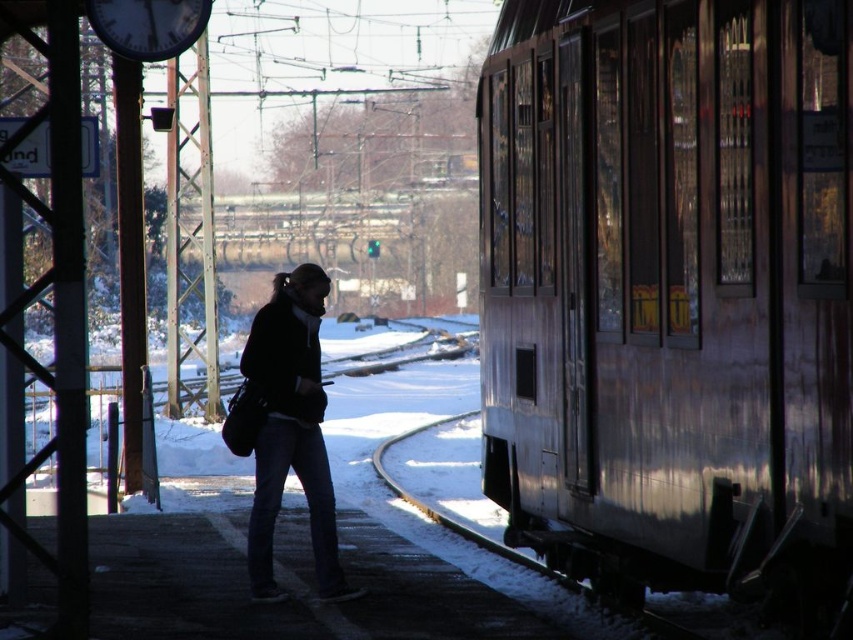
Does wooden paneling train at right have a smaller size compared to dark blue jeans at center?

Indeed, wooden paneling train at right has a smaller size compared to dark blue jeans at center.

How far apart are wooden paneling train at right and dark blue jeans at center?

wooden paneling train at right is 4.32 meters away from dark blue jeans at center.

What do you see at coordinates (670, 291) in the screenshot?
I see `wooden paneling train at right` at bounding box center [670, 291].

Find the location of a particular element. The width and height of the screenshot is (853, 640). wooden paneling train at right is located at coordinates (670, 291).